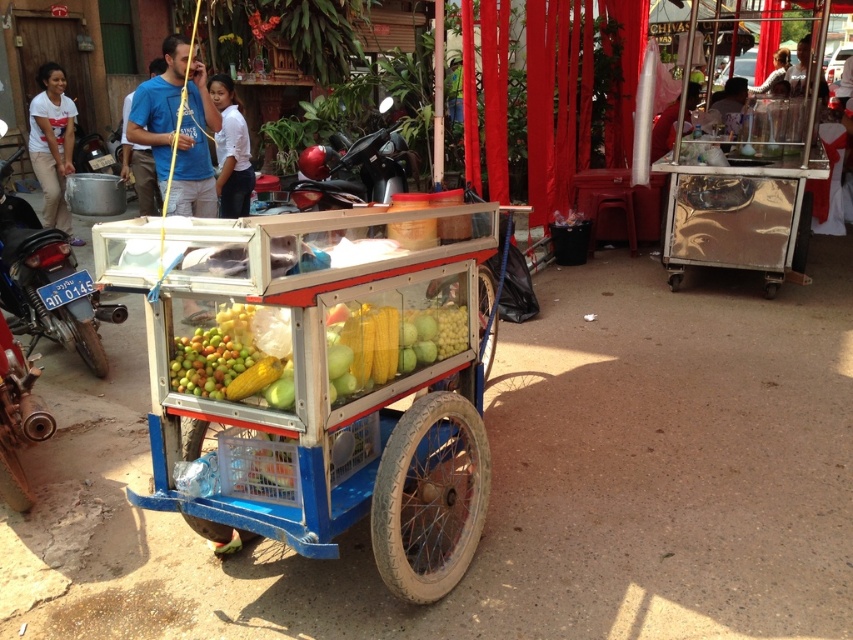
Who is positioned more to the right, shiny black motorcycle at center or white cotton shirt at upper left?

From the viewer's perspective, shiny black motorcycle at center appears more on the right side.

Is shiny black motorcycle at center bigger than white cotton shirt at upper left?

No.

Find the location of a particular element. Image resolution: width=853 pixels, height=640 pixels. shiny black motorcycle at center is located at coordinates (352, 172).

Is the position of green matte corn at center less distant than that of white smooth shirt at center?

Yes, it is in front of white smooth shirt at center.

Which is below, green matte corn at center or white smooth shirt at center?

green matte corn at center is below.

Which is in front, point (285, 332) or point (241, 109)?

Point (285, 332) is in front.

The width and height of the screenshot is (853, 640). What are the coordinates of `green matte corn at center` in the screenshot? It's located at (236, 356).

Between green matte corn at center and shiny black motorcycle at center, which one is positioned higher?

Positioned higher is shiny black motorcycle at center.

Between green matte corn at center and shiny black motorcycle at center, which one is positioned lower?

green matte corn at center is lower down.

Between point (434, 328) and point (291, 182), which one is positioned behind?

Point (291, 182)

At what (x,y) coordinates should I click in order to perform the action: click on green matte corn at center. Please return your answer as a coordinate pair (x, y). The height and width of the screenshot is (640, 853). Looking at the image, I should click on (236, 356).